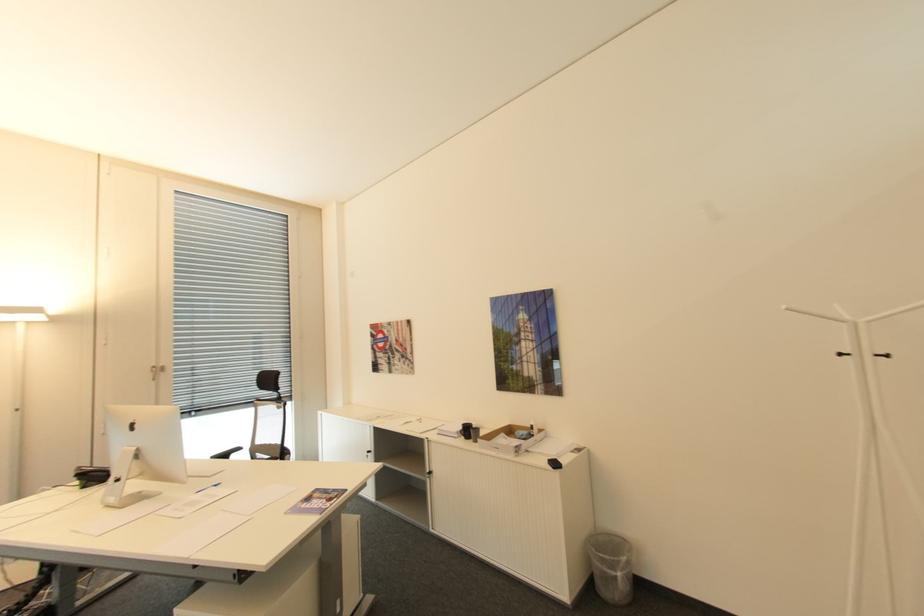
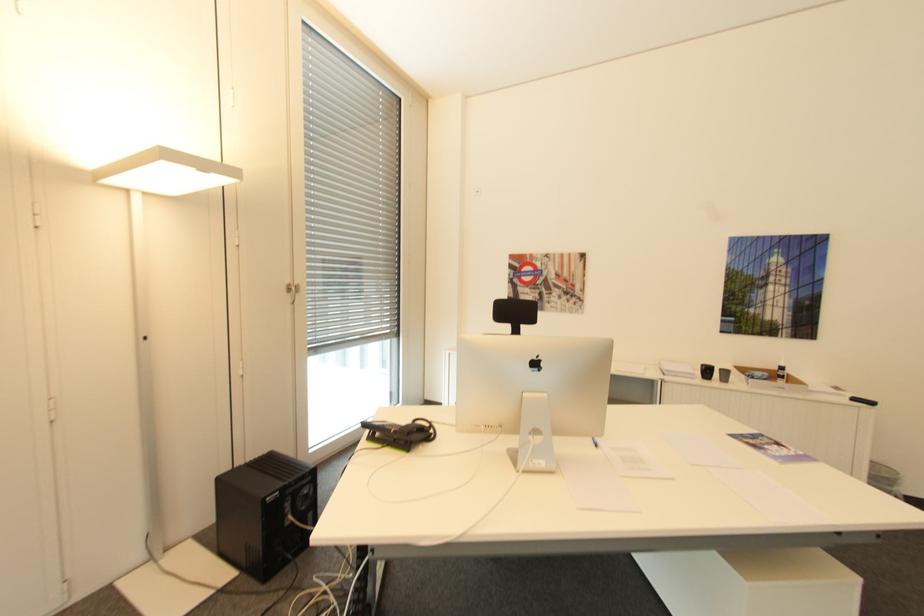
Question: Which direction would the cameraman need to move to produce the second image? Reply with the corresponding letter.

Choices:
 (A) Left
 (B) Right
 (C) Forward
 (D) Backward

Answer: (A)